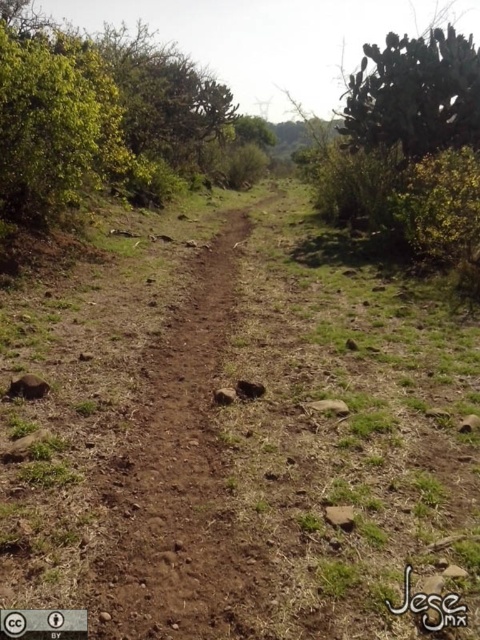
Question: Does brown dirt track at center have a smaller size compared to green spiny cactus at upper right?

Choices:
 (A) no
 (B) yes

Answer: (B)

Question: Which of these objects is positioned closest to the brown dirt track at center?

Choices:
 (A) green spiny cactus at upper right
 (B) dirt path at center

Answer: (B)

Question: Can you confirm if dirt path at center is smaller than brown dirt track at center?

Choices:
 (A) no
 (B) yes

Answer: (A)

Question: Which object is closer to the camera taking this photo?

Choices:
 (A) green spiny cactus at upper right
 (B) brown dirt track at center

Answer: (B)

Question: Which object is the closest to the brown dirt track at center?

Choices:
 (A) green spiny cactus at upper right
 (B) dirt path at center

Answer: (B)

Question: Does dirt path at center appear over brown dirt track at center?

Choices:
 (A) yes
 (B) no

Answer: (A)